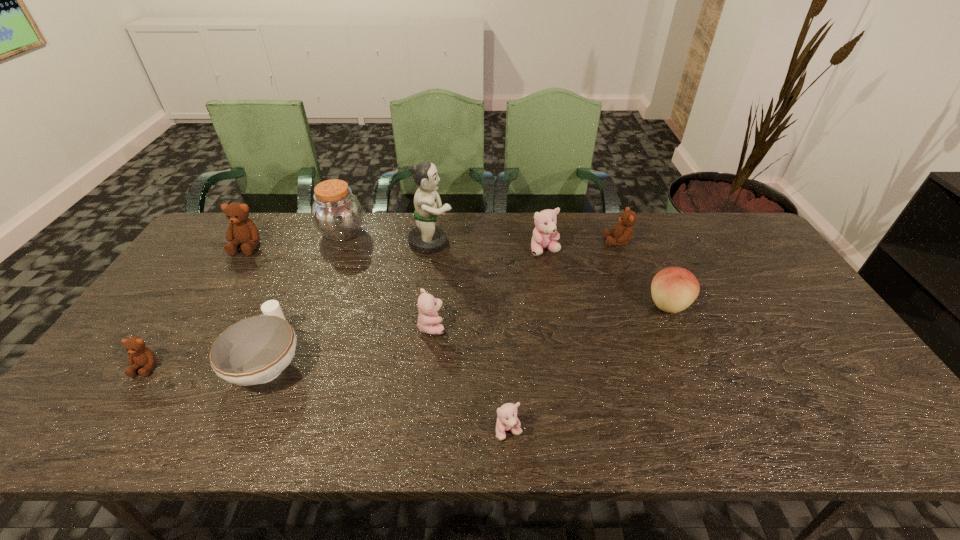
The width and height of the screenshot is (960, 540). I want to click on peach, so click(x=673, y=289).

You are a GUI agent. You are given a task and a screenshot of the screen. Output one action in this format:
    pyautogui.click(x=<x>, y=<y>)
    Task: Click on the white chinaware
    Image resolution: width=960 pixels, height=540 pixels.
    Given the screenshot: What is the action you would take?
    pyautogui.click(x=255, y=350)

Identify the location of the nearest brown teddy bear. This screenshot has width=960, height=540. (140, 356).

At what (x,y) coordinates should I click in order to perform the action: click on the fifth farthest teddy bear. Please return your answer as a coordinate pair (x, y). The height and width of the screenshot is (540, 960). Looking at the image, I should click on (140, 356).

Find the location of `the third teddy bear from right to left`. the third teddy bear from right to left is located at coordinates (507, 420).

Identify the location of the nearest teddy bear. This screenshot has width=960, height=540. (507, 420).

In order to click on vacant space located on the front-facing side of the figurine in this screenshot , I will do `click(484, 243)`.

Identify the location of free space located 0.280m on the front of the jar. This screenshot has height=540, width=960. click(312, 309).

Locate an element on the screen. This screenshot has width=960, height=540. vacant space located 0.110m at the face of the third object from right to left is located at coordinates (551, 282).

I want to click on free space located on the face of the biggest brown teddy bear, so click(184, 345).